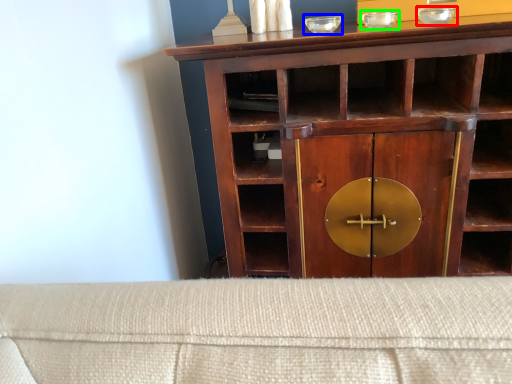
Question: Considering the real-world distances, which object is closest to glass bowl (highlighted by a red box)? glass bowl (highlighted by a blue box) or glass bowl (highlighted by a green box).

Choices:
 (A) glass bowl
 (B) glass bowl

Answer: (B)